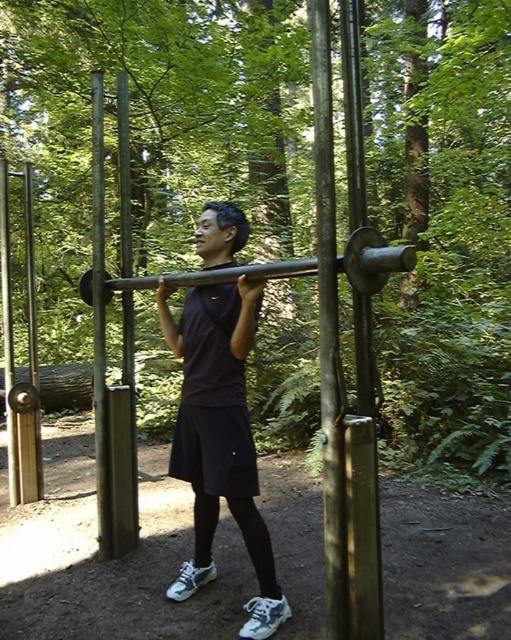
You are a photographer trying to capture the man in the forest. You notice the smooth metal pole at center and the black metallic barbell at center. Which object is closer to the camera?

The smooth metal pole at center is closer to the camera because the black metallic barbell at center is behind it.

You are a photographer setting up a shot in the forest. You have two objects in your viewfinder, the smooth metal pole at center and the black metallic barbell at center. Which object appears taller in the photo?

The smooth metal pole at center appears taller than the black metallic barbell at center in the photo.

You are a photographer trying to capture the man in the dark purple shirt at center and the black metallic barbell at center. From your current position, which object is closer to the left side of your camera frame?

The dark purple shirt at center is positioned on the left side of the black metallic barbell at center, so the dark purple shirt at center is closer to the left side of the camera frame.